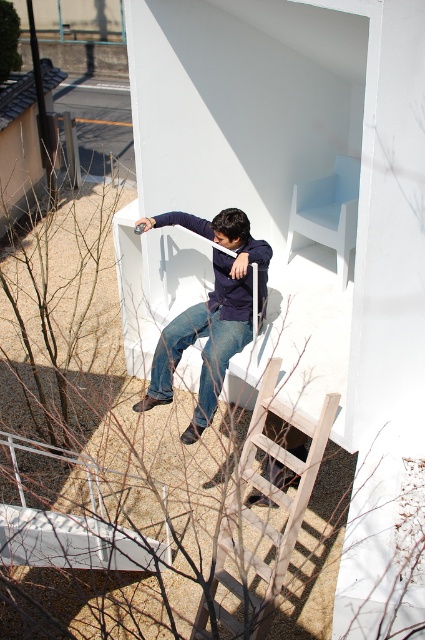
Who is higher up, matte blue jeans at center or blue denim jeans at lower center?

Positioned higher is matte blue jeans at center.

Find the location of `matte blue jeans at center`. matte blue jeans at center is located at coordinates coord(209,312).

Where is `matte blue jeans at center`? matte blue jeans at center is located at coordinates pyautogui.click(x=209, y=312).

Is matte blue jeans at center closer to camera compared to wooden ladder at lower center?

No, it is behind wooden ladder at lower center.

Does matte blue jeans at center appear on the left side of wooden ladder at lower center?

Correct, you'll find matte blue jeans at center to the left of wooden ladder at lower center.

At what (x,y) coordinates should I click in order to perform the action: click on matte blue jeans at center. Please return your answer as a coordinate pair (x, y). Looking at the image, I should click on (209, 312).

Can you confirm if matte blue jeans at center is positioned below white matte chair at upper center?

Indeed, matte blue jeans at center is positioned under white matte chair at upper center.

Is matte blue jeans at center closer to camera compared to white matte chair at upper center?

That is True.

The width and height of the screenshot is (425, 640). In order to click on matte blue jeans at center in this screenshot , I will do `click(209, 312)`.